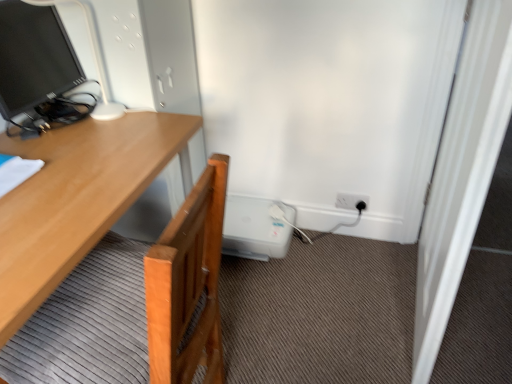
The height and width of the screenshot is (384, 512). I want to click on vacant space underneath white wooden screen door at right (from a real-world perspective), so click(407, 299).